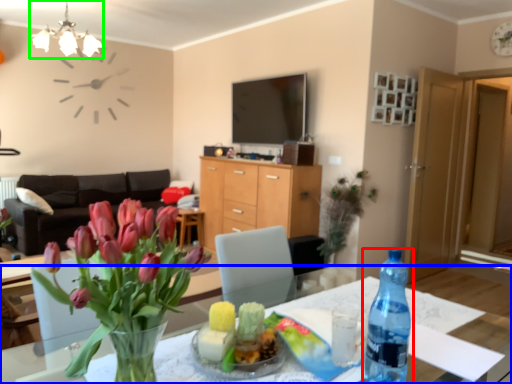
Question: Which object is positioned closest to bottle (highlighted by a red box)? Select from desk (highlighted by a blue box) and light fixture (highlighted by a green box).

Choices:
 (A) desk
 (B) light fixture

Answer: (A)